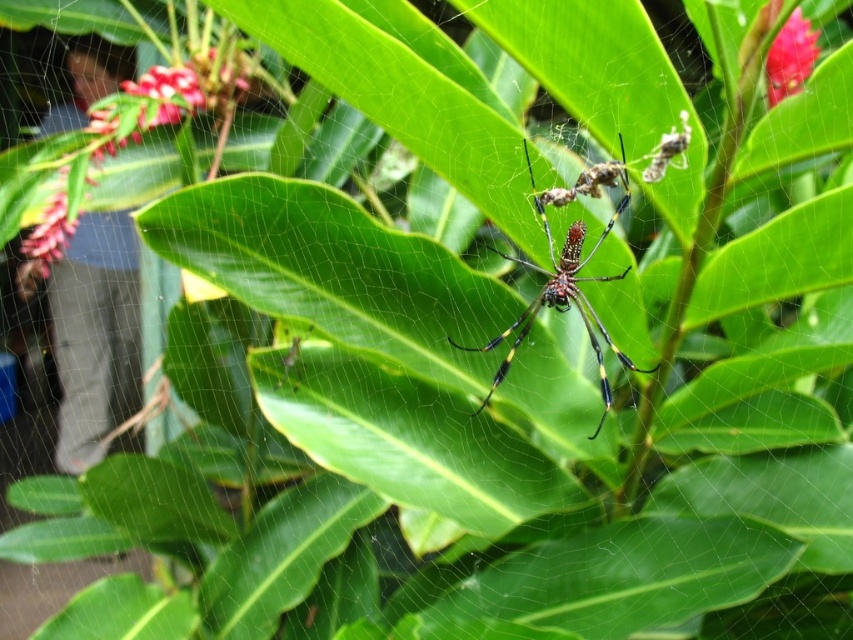
You are a gardener who wants to place a small decorative statue exactly halfway between the glossy pink flower at upper left and the shiny metallic spider at center. Which object will the statue be closer to?

The statue will be closer to the shiny metallic spider at center because the glossy pink flower at upper left is taller than the shiny metallic spider at center, so the halfway point would be closer to the spider.

You are a bee trying to collect nectar from both the glossy pink flower at upper left and the glossy pink flower at upper right. Given that your flight range is 2 meters, can you reach both flowers without needing to return to the hive?

The glossy pink flower at upper left is 2.07 meters from the glossy pink flower at upper right. Since the distance between them is slightly more than your 2 meter flight range, you cannot reach both flowers without needing to return to the hive.